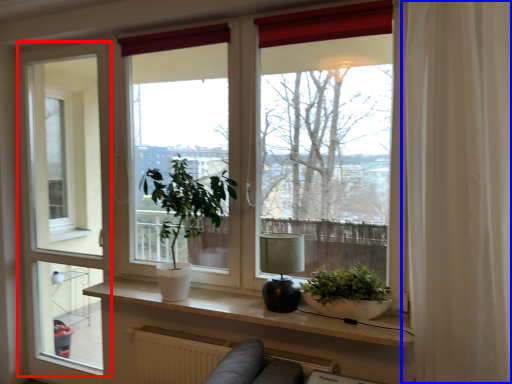
Question: Among these objects, which one is farthest to the camera, screen door (highlighted by a red box) or curtain (highlighted by a blue box)?

Choices:
 (A) screen door
 (B) curtain

Answer: (A)